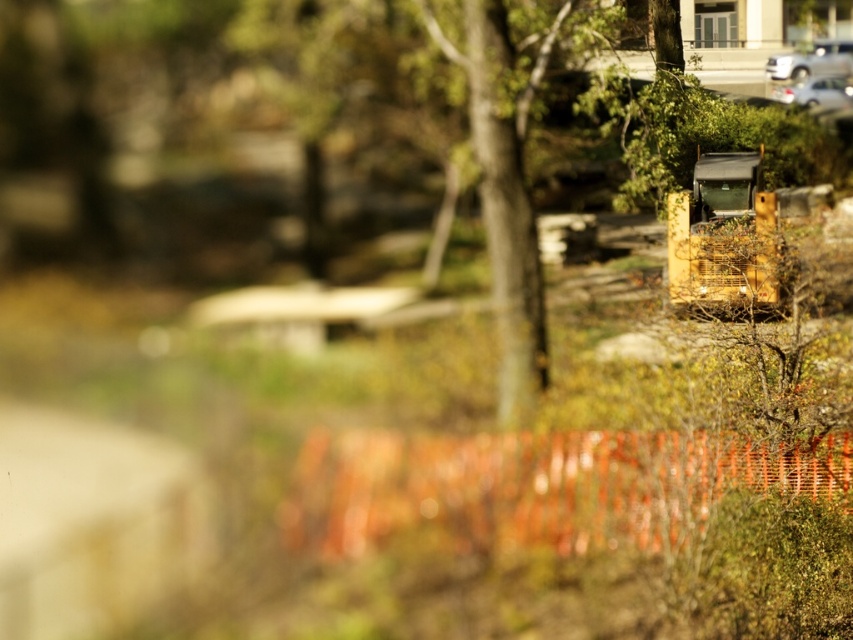
Is point (498, 369) positioned after point (836, 100)?

No, it is not.

Consider the image. Is green leafy tree at center shorter than silver metallic car at upper right?

In fact, green leafy tree at center may be taller than silver metallic car at upper right.

Identify the location of green leafy tree at center. (505, 189).

Can you confirm if green leafy tree at center is wider than metallic silver car at upper right?

Incorrect, green leafy tree at center's width does not surpass metallic silver car at upper right's.

Does green leafy tree at center have a larger size compared to metallic silver car at upper right?

Correct, green leafy tree at center is larger in size than metallic silver car at upper right.

Who is more forward, (479, 150) or (815, 67)?

Point (479, 150)

Image resolution: width=853 pixels, height=640 pixels. What are the coordinates of `green leafy tree at center` in the screenshot? It's located at (505, 189).

Which of these two, metallic silver car at upper right or silver metallic car at upper right, stands taller?

Standing taller between the two is metallic silver car at upper right.

In the scene shown: Does metallic silver car at upper right have a lesser height compared to silver metallic car at upper right?

No, metallic silver car at upper right is not shorter than silver metallic car at upper right.

I want to click on metallic silver car at upper right, so click(811, 60).